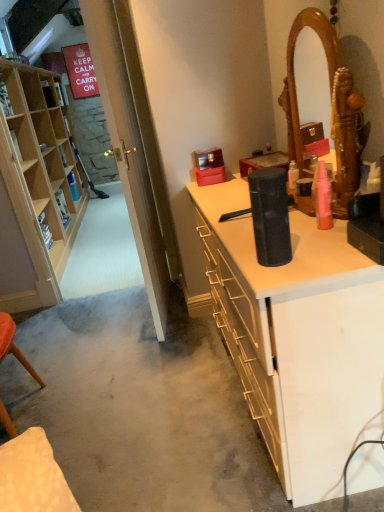
Where is `free space that is to the left of black matte speaker at center`? free space that is to the left of black matte speaker at center is located at coordinates (168, 401).